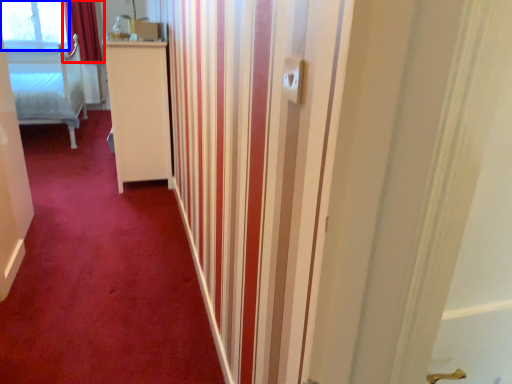
Question: Which of the following is the closest to the observer, curtain (highlighted by a red box) or window (highlighted by a blue box)?

Choices:
 (A) curtain
 (B) window

Answer: (A)